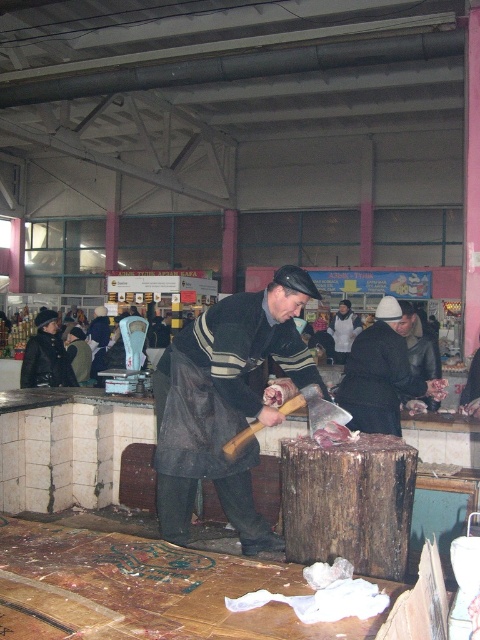
Which is above, dark gray woolen coat at center or meat raw at center?

Positioned higher is meat raw at center.

Which is behind, point (189, 464) or point (446, 384)?

Point (446, 384)

Is point (156, 454) more distant than point (443, 396)?

No, it is in front of (443, 396).

You are a GUI agent. You are given a task and a screenshot of the screen. Output one action in this format:
    pyautogui.click(x=<x>, y=<y>)
    Task: Click on the dark gray woolen coat at center
    Image resolution: width=480 pixels, height=640 pixels.
    Given the screenshot: What is the action you would take?
    pyautogui.click(x=225, y=403)

Who is positioned more to the left, pinkish meat at center or meat raw at center?

pinkish meat at center

Does pinkish meat at center appear under meat raw at center?

Yes.

Image resolution: width=480 pixels, height=640 pixels. What are the coordinates of `pinkish meat at center` in the screenshot? It's located at tap(334, 435).

Does dark gray woolen coat at center appear under pinkish meat at center?

No.

Does point (216, 465) come closer to viewer compared to point (338, 436)?

No.

The height and width of the screenshot is (640, 480). I want to click on dark gray woolen coat at center, so click(x=225, y=403).